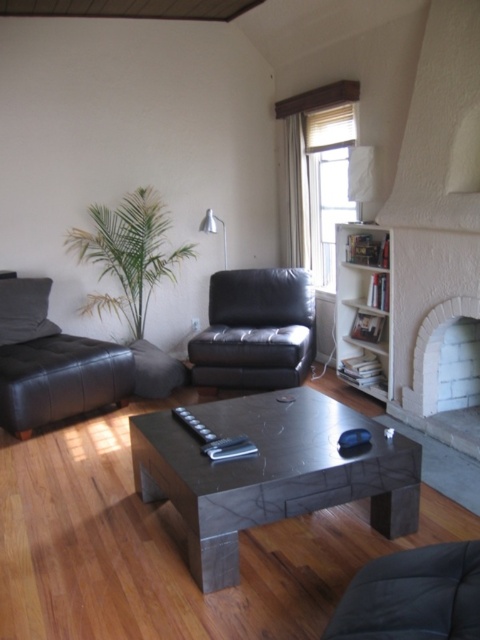
Question: Among these objects, which one is farthest from the camera?

Choices:
 (A) matte black armchair at left
 (B) white wooden bookshelf at right
 (C) white brick fireplace at right

Answer: (B)

Question: Is white wooden bookshelf at right positioned before white brick fireplace at right?

Choices:
 (A) no
 (B) yes

Answer: (A)

Question: Is matte black chair at lower right to the right of matte white lampshade at upper center from the viewer's perspective?

Choices:
 (A) yes
 (B) no

Answer: (A)

Question: Which point is farther to the camera?

Choices:
 (A) white brick fireplace at right
 (B) white wooden bookshelf at right
 (C) matte black armchair at left

Answer: (B)

Question: Which point is closer to the camera?

Choices:
 (A) (433, 381)
 (B) (132, 420)

Answer: (B)

Question: Considering the relative positions of matte black chair at lower right and white wooden bookshelf at right in the image provided, where is matte black chair at lower right located with respect to white wooden bookshelf at right?

Choices:
 (A) left
 (B) right

Answer: (A)